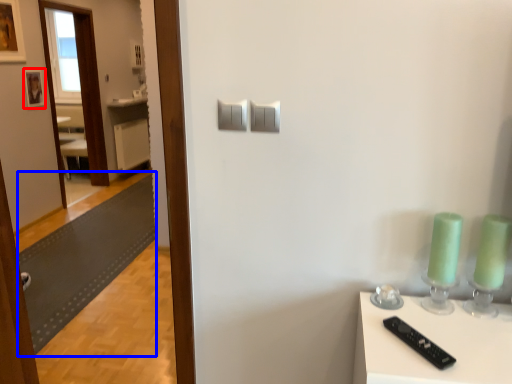
Question: Which of the following is the farthest to the observer, picture frame (highlighted by a red box) or mat (highlighted by a blue box)?

Choices:
 (A) picture frame
 (B) mat

Answer: (A)